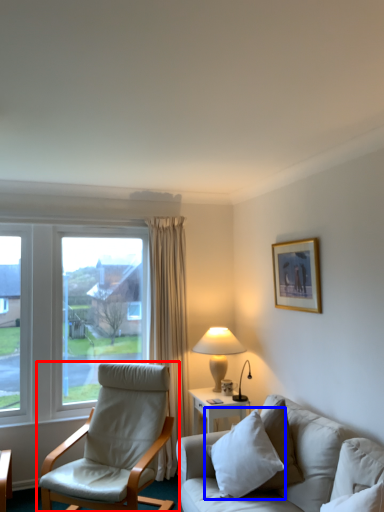
Question: Which object appears closest to the camera in this image, chair (highlighted by a red box) or pillow (highlighted by a blue box)?

Choices:
 (A) chair
 (B) pillow

Answer: (B)